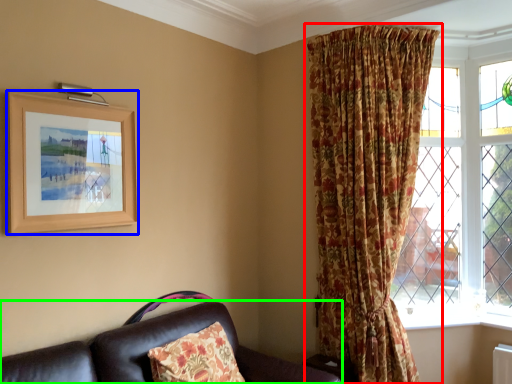
Question: Which object is the farthest from curtain (highlighted by a red box)? Choose among these: picture frame (highlighted by a blue box) or studio couch (highlighted by a green box).

Choices:
 (A) picture frame
 (B) studio couch

Answer: (A)